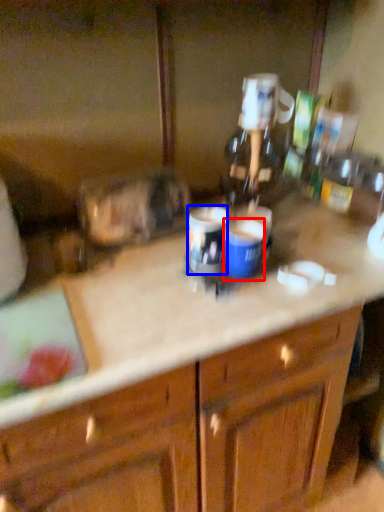
Question: Which of the following is the closest to the observer, beverage (highlighted by a red box) or beverage (highlighted by a blue box)?

Choices:
 (A) beverage
 (B) beverage

Answer: (A)